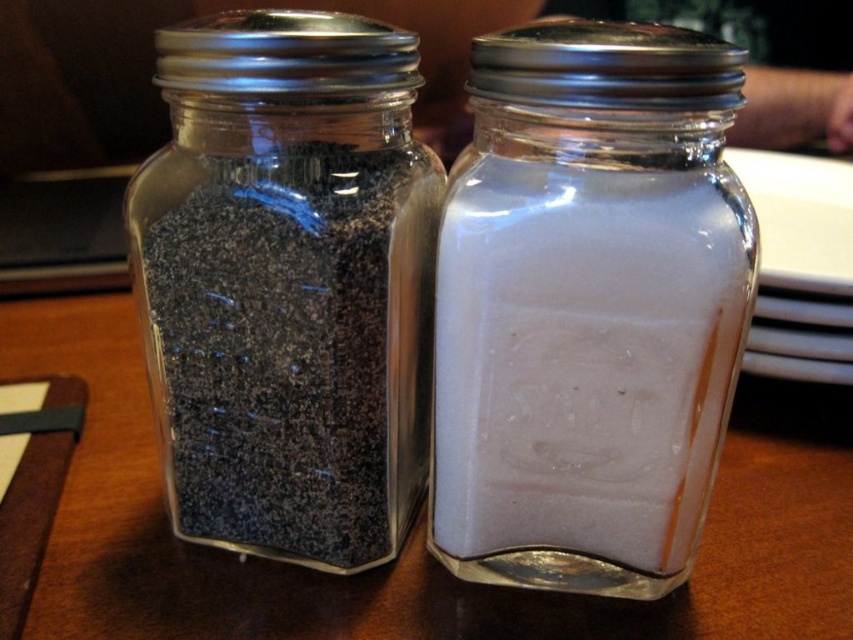
Question: Which of the following is the closest to the observer?

Choices:
 (A) (148, 356)
 (B) (601, 36)

Answer: (B)

Question: Which of the following is the farthest from the observer?

Choices:
 (A) (711, 81)
 (B) (344, 116)

Answer: (B)

Question: Where is white glass salt shaker at center located in relation to matte black pepper at left in the image?

Choices:
 (A) below
 (B) above

Answer: (A)

Question: Does white glass salt shaker at center have a larger size compared to matte black pepper at left?

Choices:
 (A) yes
 (B) no

Answer: (B)

Question: Does white glass salt shaker at center have a lesser width compared to matte black pepper at left?

Choices:
 (A) yes
 (B) no

Answer: (A)

Question: Which point appears farthest from the camera in this image?

Choices:
 (A) (367, 531)
 (B) (672, 579)

Answer: (A)